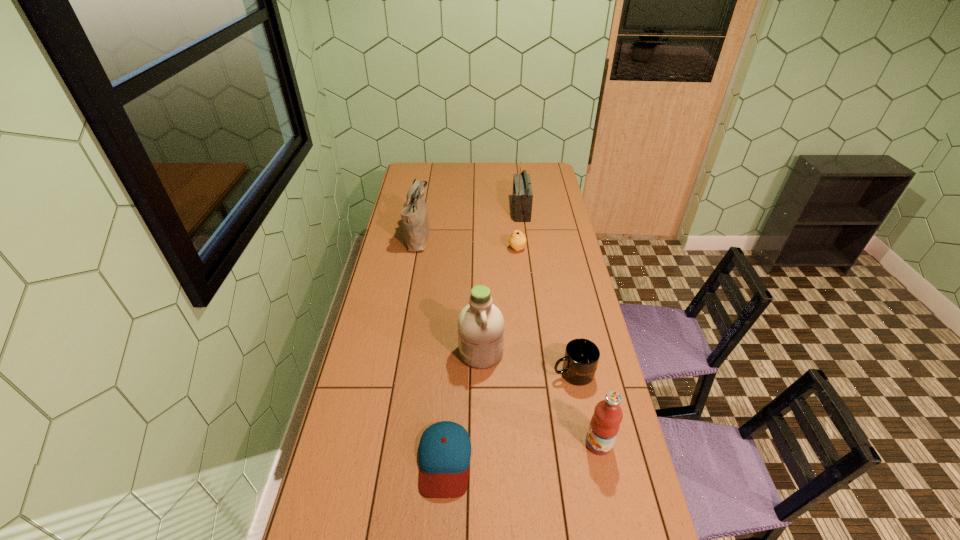
Locate an element on the screen. This screenshot has width=960, height=540. free space located 0.280m on the front-facing side of the leftmost object is located at coordinates point(489,237).

I want to click on free space located 0.260m on the front label of the cleansing agent, so click(x=388, y=352).

At what (x,y) coordinates should I click in order to perform the action: click on free point located 0.170m on the front label of the cleansing agent. Please return your answer as a coordinate pair (x, y). The height and width of the screenshot is (540, 960). Looking at the image, I should click on (413, 352).

Locate an element on the screen. Image resolution: width=960 pixels, height=540 pixels. vacant space located 0.350m on the front label of the cleansing agent is located at coordinates (364, 352).

This screenshot has height=540, width=960. I want to click on vacant space located 0.380m on the front label of the fruit juice, so click(x=462, y=444).

This screenshot has width=960, height=540. Identify the location of blank space located 0.090m on the front label of the fruit juice. (556, 444).

The image size is (960, 540). In order to click on free location located on the front label of the fruit juice in this screenshot , I will do point(507,444).

The width and height of the screenshot is (960, 540). I want to click on free space located 0.290m with the handle on the side of the mug, so click(x=469, y=374).

Where is `vacant space located with the handle on the side of the mug`? vacant space located with the handle on the side of the mug is located at coordinates (469, 374).

At what (x,y) coordinates should I click in order to perform the action: click on free space located with the handle on the side of the mug. Please return your answer as a coordinate pair (x, y). Image resolution: width=960 pixels, height=540 pixels. Looking at the image, I should click on (490, 374).